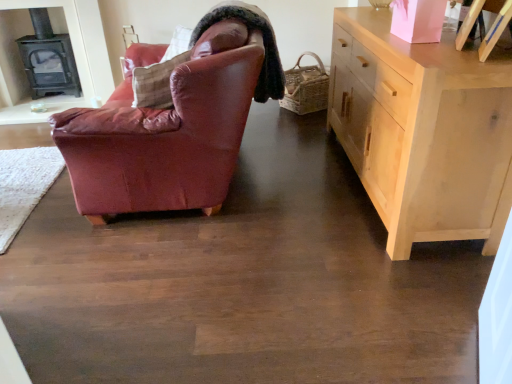
Question: Is light wood cabinet at right surrounding black cast iron fireplace at upper left?

Choices:
 (A) yes
 (B) no

Answer: (B)

Question: From a real-world perspective, is light wood cabinet at right beneath black cast iron fireplace at upper left?

Choices:
 (A) no
 (B) yes

Answer: (B)

Question: Is the position of light wood cabinet at right more distant than that of black cast iron fireplace at upper left?

Choices:
 (A) yes
 (B) no

Answer: (B)

Question: Is light wood cabinet at right positioned beyond the bounds of black cast iron fireplace at upper left?

Choices:
 (A) yes
 (B) no

Answer: (A)

Question: Is light wood cabinet at right thinner than black cast iron fireplace at upper left?

Choices:
 (A) no
 (B) yes

Answer: (A)

Question: Can you confirm if light wood cabinet at right is shorter than black cast iron fireplace at upper left?

Choices:
 (A) no
 (B) yes

Answer: (A)

Question: Does leather-like brown pillow at upper center turn towards black cast iron fireplace at upper left?

Choices:
 (A) yes
 (B) no

Answer: (B)

Question: Does leather-like brown pillow at upper center have a larger size compared to black cast iron fireplace at upper left?

Choices:
 (A) no
 (B) yes

Answer: (A)

Question: Does leather-like brown pillow at upper center have a greater height compared to black cast iron fireplace at upper left?

Choices:
 (A) no
 (B) yes

Answer: (A)

Question: Considering the relative sizes of leather-like brown pillow at upper center and black cast iron fireplace at upper left in the image provided, is leather-like brown pillow at upper center smaller than black cast iron fireplace at upper left?

Choices:
 (A) yes
 (B) no

Answer: (A)

Question: Is leather-like brown pillow at upper center facing away from black cast iron fireplace at upper left?

Choices:
 (A) no
 (B) yes

Answer: (A)

Question: From a real-world perspective, is leather-like brown pillow at upper center beneath black cast iron fireplace at upper left?

Choices:
 (A) no
 (B) yes

Answer: (A)

Question: Would you say light wood cabinet at right contains leather-like brown pillow at upper center?

Choices:
 (A) no
 (B) yes

Answer: (A)